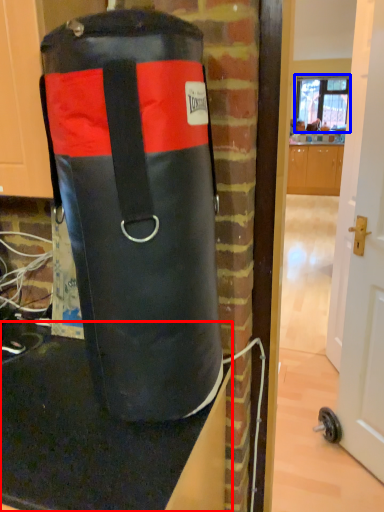
Question: Which object appears farthest to the camera in this image, table top (highlighted by a red box) or window screen (highlighted by a blue box)?

Choices:
 (A) table top
 (B) window screen

Answer: (B)